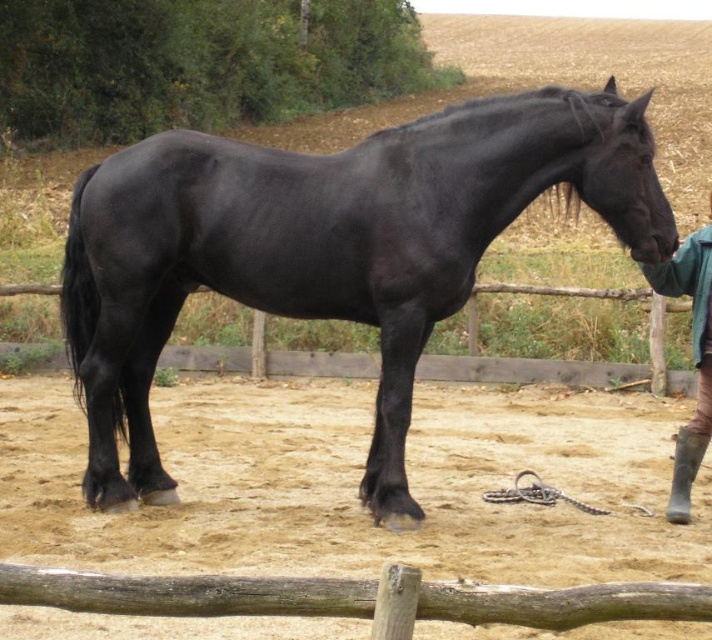
Consider the image. Can you confirm if wooden fence at center is bigger than green fabric jacket at lower right?

Yes.

Which is in front, point (614, 380) or point (698, 252)?

Positioned in front is point (698, 252).

You are a GUI agent. You are given a task and a screenshot of the screen. Output one action in this format:
    pyautogui.click(x=<x>, y=<y>)
    Task: Click on the wooden fence at center
    Image resolution: width=712 pixels, height=640 pixels.
    Given the screenshot: What is the action you would take?
    pyautogui.click(x=562, y=358)

Describe the element at coordinates (325, 250) in the screenshot. I see `black glossy horse at center` at that location.

Which is behind, point (397, 456) or point (674, 522)?

Point (674, 522)

Between point (287, 173) and point (701, 433), which one is positioned behind?

The point (701, 433) is behind.

Image resolution: width=712 pixels, height=640 pixels. What are the coordinates of `black glossy horse at center` in the screenshot? It's located at (325, 250).

Which is above, black glossy horse at center or wooden fence at center?

black glossy horse at center is above.

Is black glossy horse at center to the right of wooden fence at center from the viewer's perspective?

Incorrect, black glossy horse at center is not on the right side of wooden fence at center.

Locate an element on the screen. This screenshot has height=640, width=712. black glossy horse at center is located at coordinates (325, 250).